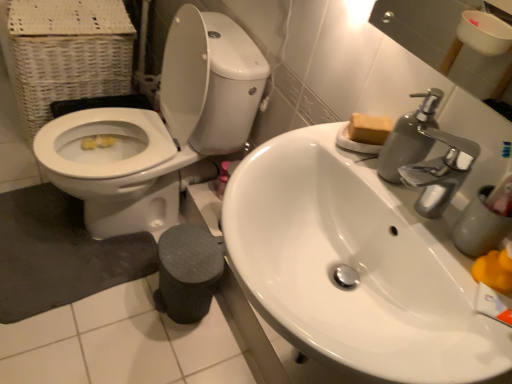
The image size is (512, 384). Find the location of `free spot in front of silver metallic faucet at upper right`. free spot in front of silver metallic faucet at upper right is located at coordinates (453, 290).